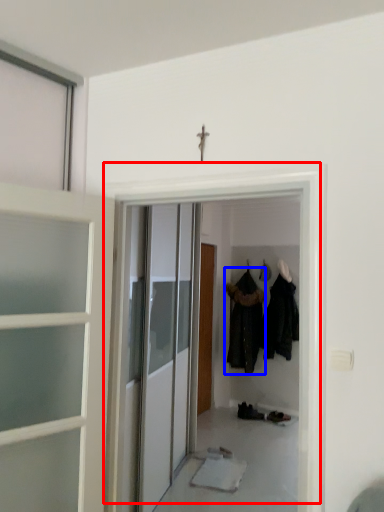
Question: Which object is closer to the camera taking this photo, door (highlighted by a red box) or clothing (highlighted by a blue box)?

Choices:
 (A) door
 (B) clothing

Answer: (A)